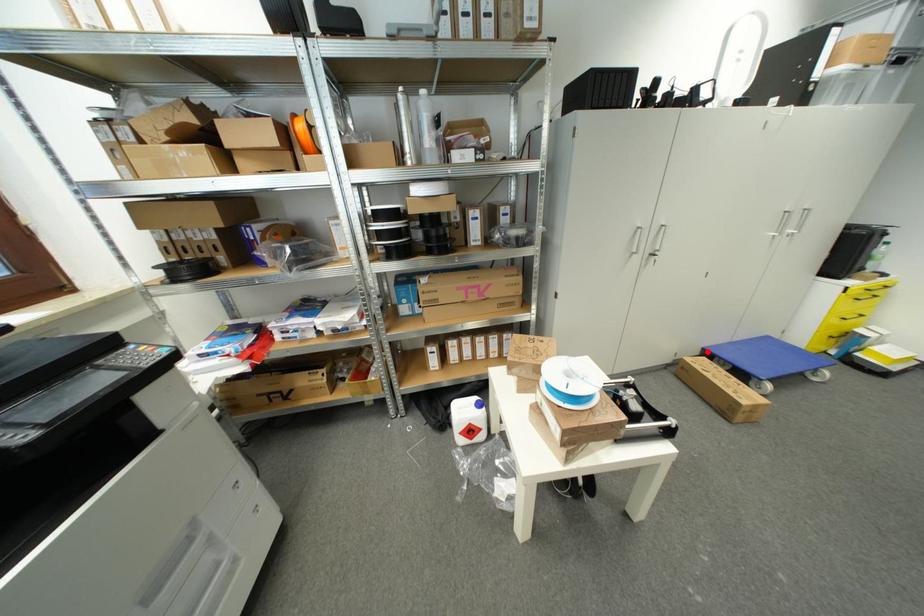
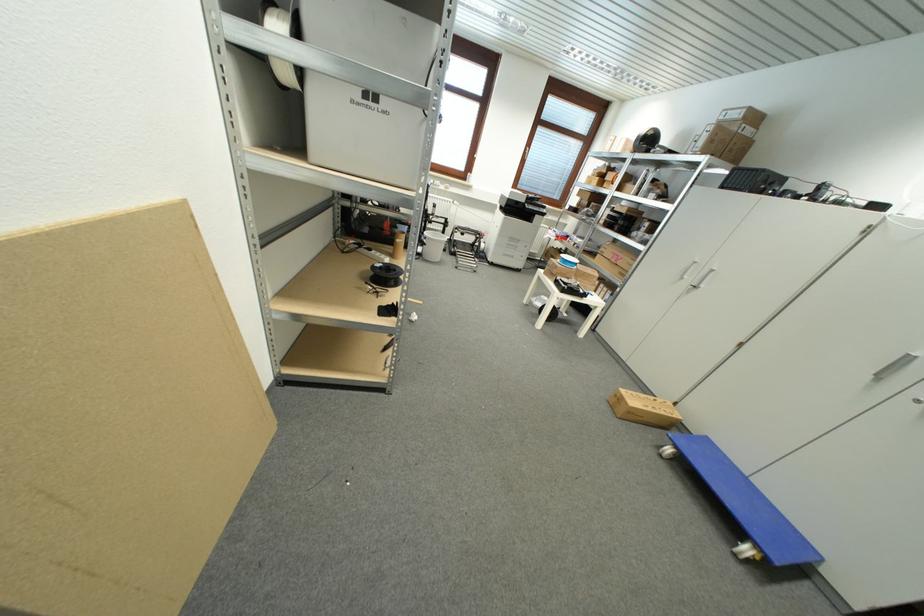
Question: I am providing you with two images of the same scene from different viewpoints. A red point is shown in image1. For the corresponding object point in image2, is it positioned nearer or farther from the camera?

Choices:
 (A) Nearer
 (B) Farther

Answer: (A)